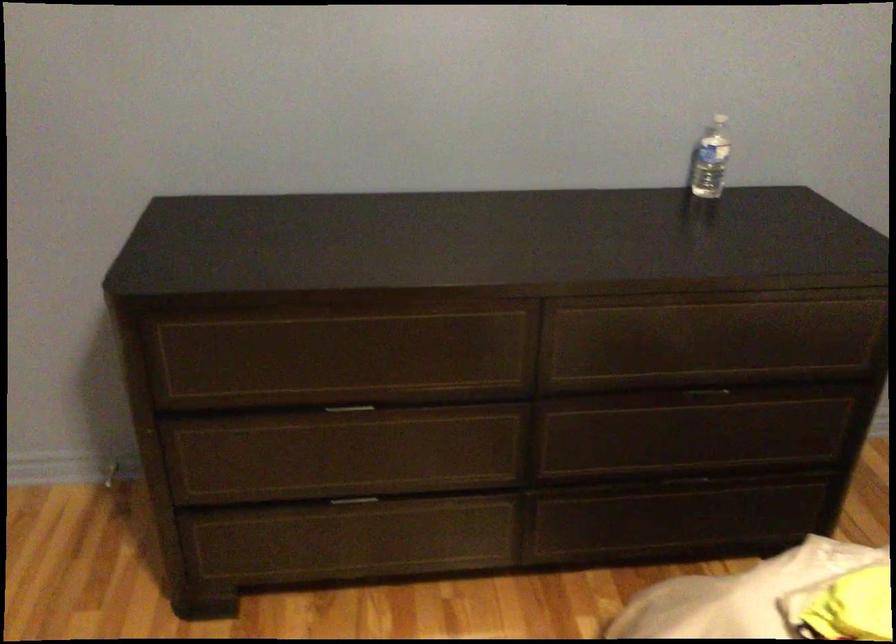
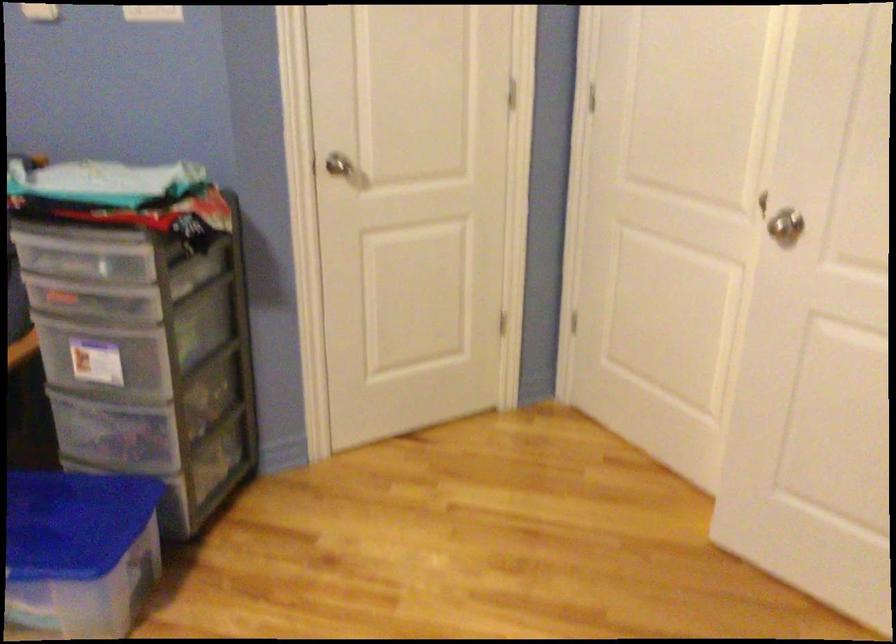
Based on the photo, based on the continuous images, in which direction is the camera rotating?

The camera's rotation is toward left-down.